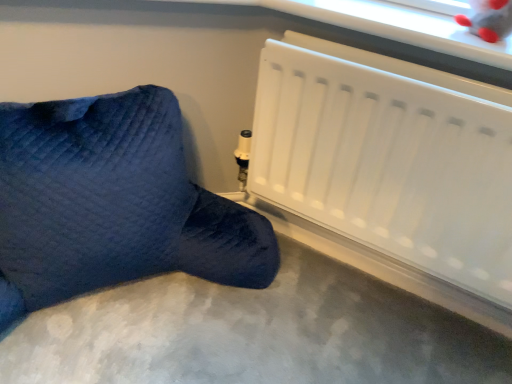
Question: Is smooth gray carpet at lower center aimed at velvety blue bean bag at lower left?

Choices:
 (A) yes
 (B) no

Answer: (B)

Question: Can you confirm if smooth gray carpet at lower center is positioned to the right of velvety blue bean bag at lower left?

Choices:
 (A) yes
 (B) no

Answer: (A)

Question: Is smooth gray carpet at lower center taller than velvety blue bean bag at lower left?

Choices:
 (A) yes
 (B) no

Answer: (B)

Question: Is smooth gray carpet at lower center surrounding velvety blue bean bag at lower left?

Choices:
 (A) yes
 (B) no

Answer: (B)

Question: Is smooth gray carpet at lower center with velvety blue bean bag at lower left?

Choices:
 (A) no
 (B) yes

Answer: (A)

Question: Can you confirm if smooth gray carpet at lower center is shorter than velvety blue bean bag at lower left?

Choices:
 (A) no
 (B) yes

Answer: (B)

Question: From a real-world perspective, is velvety blue bean bag at lower left under smooth gray carpet at lower center?

Choices:
 (A) no
 (B) yes

Answer: (A)

Question: Does velvety blue bean bag at lower left have a lesser width compared to smooth gray carpet at lower center?

Choices:
 (A) yes
 (B) no

Answer: (A)

Question: From the image's perspective, is velvety blue bean bag at lower left on top of smooth gray carpet at lower center?

Choices:
 (A) no
 (B) yes

Answer: (B)

Question: Is velvety blue bean bag at lower left looking in the opposite direction of smooth gray carpet at lower center?

Choices:
 (A) no
 (B) yes

Answer: (A)

Question: Can you confirm if velvety blue bean bag at lower left is shorter than smooth gray carpet at lower center?

Choices:
 (A) no
 (B) yes

Answer: (A)

Question: Considering the relative sizes of velvety blue bean bag at lower left and smooth gray carpet at lower center in the image provided, is velvety blue bean bag at lower left bigger than smooth gray carpet at lower center?

Choices:
 (A) yes
 (B) no

Answer: (A)

Question: Is white matte radiator at lower right located outside smooth gray carpet at lower center?

Choices:
 (A) no
 (B) yes

Answer: (B)